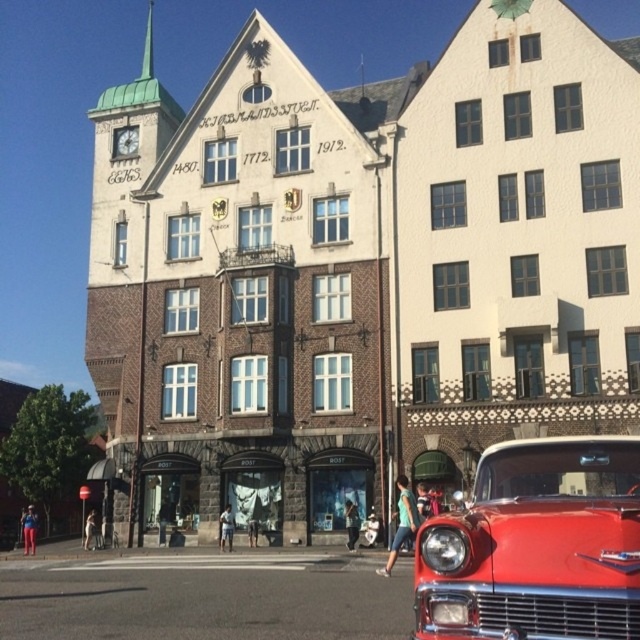
Between point (122, 381) and point (586, 403), which one is positioned behind?

The point (122, 381) is behind.

Who is more forward, (x=323, y=182) or (x=561, y=170)?

Point (x=561, y=170) is more forward.

At what (x,y) coordinates should I click in order to perform the action: click on brick building at center. Please return your answer as a coordinate pair (x, y). Looking at the image, I should click on (362, 269).

Who is higher up, white painted wood building at center or shiny red car at lower right?

white painted wood building at center is higher up.

The width and height of the screenshot is (640, 640). Identify the location of white painted wood building at center. (516, 240).

Can you confirm if brick building at center is thinner than shiny red car at lower right?

No, brick building at center is not thinner than shiny red car at lower right.

Does brick building at center appear on the right side of shiny red car at lower right?

In fact, brick building at center is to the left of shiny red car at lower right.

What do you see at coordinates (362, 269) in the screenshot? I see `brick building at center` at bounding box center [362, 269].

In order to click on brick building at center in this screenshot , I will do `click(362, 269)`.